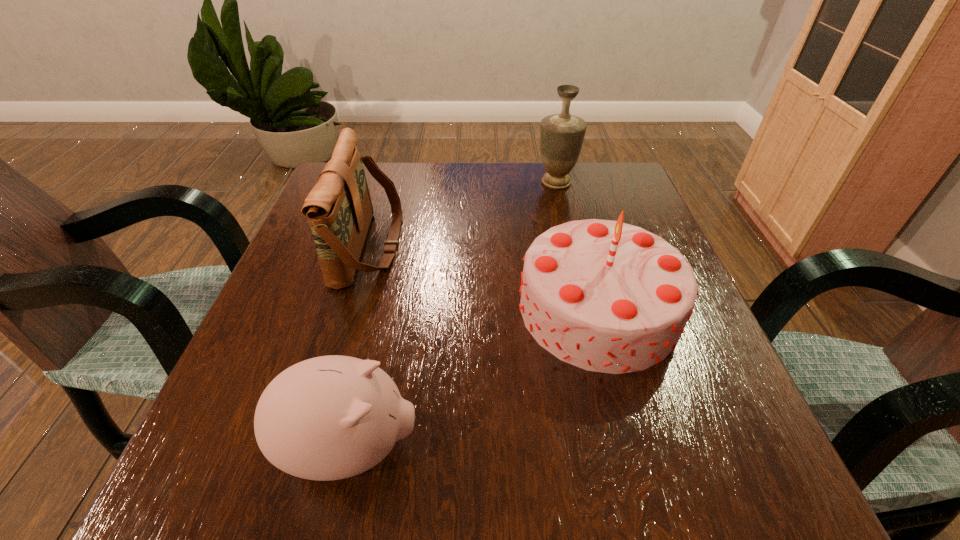
Identify the location of the farthest object. (561, 135).

Find the location of a particular element. birthday cake is located at coordinates (605, 296).

Find the location of a particular element. shoulder bag is located at coordinates (339, 209).

Locate an element on the screen. Image resolution: width=960 pixels, height=540 pixels. piggy bank is located at coordinates (332, 417).

The height and width of the screenshot is (540, 960). I want to click on the nearest object, so click(x=332, y=417).

You are a GUI agent. You are given a task and a screenshot of the screen. Output one action in this format:
    pyautogui.click(x=<x>, y=<y>)
    Task: Click on the vacant space located on the left of the farthest object
    Image resolution: width=960 pixels, height=540 pixels.
    Given the screenshot: What is the action you would take?
    pyautogui.click(x=444, y=182)

Where is `blank space located on the front of the birthday cake`? blank space located on the front of the birthday cake is located at coordinates point(630,423).

The image size is (960, 540). I want to click on vacant space located 0.370m on the front-facing side of the shoulder bag, so click(x=575, y=245).

What are the coordinates of `vacant region located 0.270m at the snout of the shortest object` in the screenshot? It's located at (616, 447).

This screenshot has height=540, width=960. Identify the location of urn situated at the far edge. (561, 135).